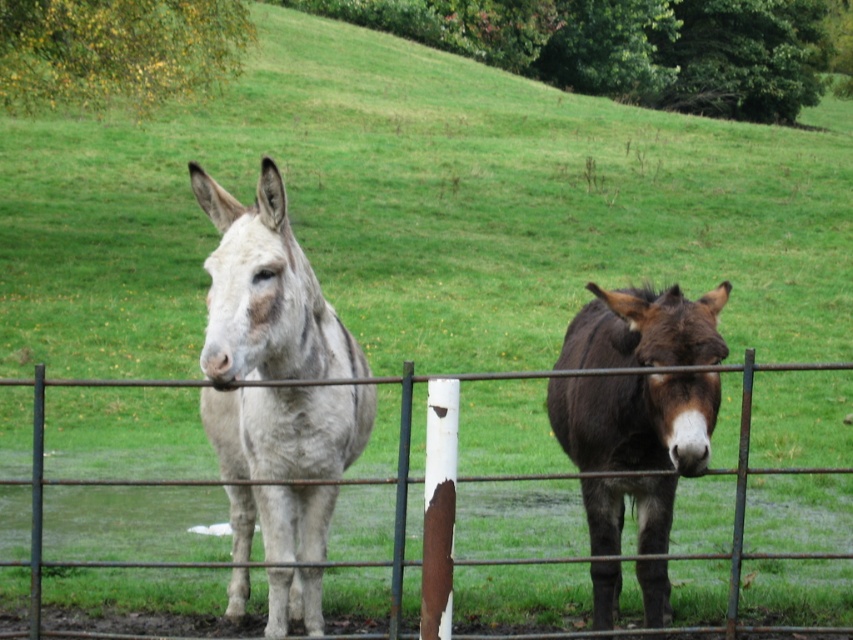
You are a farmer who wants to transport a large bale of hay. You have two mules available, the white speckled fur mule at center and the brown fuzzy mule at right. Which mule should you choose if you need the one with greater carrying capacity based on their size?

The white speckled fur mule at center has a greater width than the brown fuzzy mule at right, so it likely has a higher carrying capacity and should be chosen for transporting the large bale of hay.

Looking at this image, you are a farmer who needs to separate the two mules using a fence. The fence you have is 36 inches long. Based on the image, will the fence be long enough to place between the white speckled fur mule at center and the brown fuzzy mule at right?

The distance between the white speckled fur mule at center and the brown fuzzy mule at right is 38.60 inches. Since the fence is only 36 inches long, it will not be long enough to cover the space between them.